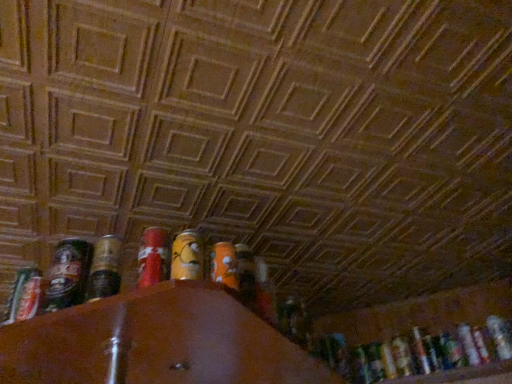
Question: Is metallic silver can at lower right, placed as the 2th beer when sorted from back to front, in front of or behind shiny metallic can at left, acting as the first beer starting from the left, in the image?

Choices:
 (A) front
 (B) behind

Answer: (B)

Question: From the image's perspective, is metallic silver can at lower right, the fifth beer in the front-to-back sequence, positioned above or below shiny metallic can at left, the first beer positioned from the front?

Choices:
 (A) above
 (B) below

Answer: (B)

Question: Estimate the real-world distances between objects in this image. Which object is farther from the translucent plastic bottle at lower right, the first beer viewed from the right?

Choices:
 (A) metallic silver can at lower right, which is the third beer from back to front
 (B) shiny metallic can at lower right, which appears as the 2th beer when viewed from the left
 (C) metallic silver spray can at left
 (D) metallic silver can at lower right, marked as the fourth beer in a back-to-front arrangement
 (E) shiny metallic can at left, acting as the first beer starting from the left

Answer: (C)

Question: Considering the real-world distances, which object is closest to the metallic silver can at lower right, which appears as the second beer when viewed from the right?

Choices:
 (A) shiny metallic can at lower right, which appears as the 2th beer when viewed from the left
 (B) metallic silver can at lower right, the fifth beer in the front-to-back sequence
 (C) shiny metallic can at left, acting as the first beer starting from the left
 (D) metallic silver spray can at left
 (E) translucent plastic bottle at lower right, the first beer viewed from the right

Answer: (E)